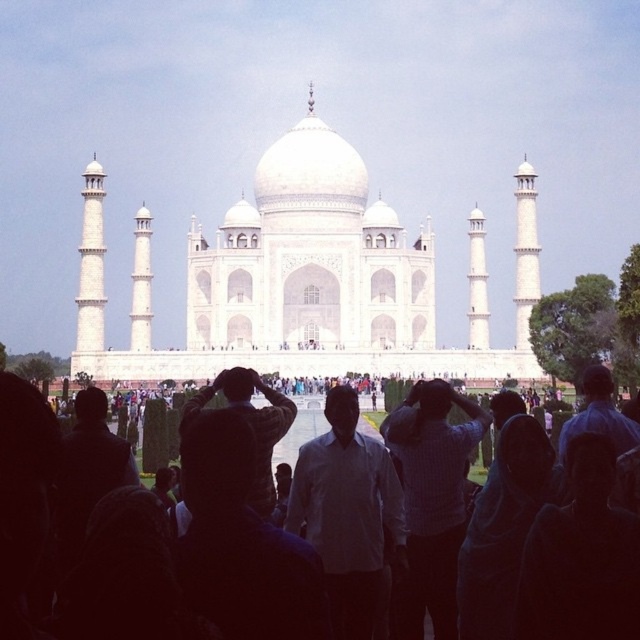
Question: Is white marble taj mahal at center closer to the viewer compared to matte white people at center?

Choices:
 (A) yes
 (B) no

Answer: (B)

Question: Which of these objects is positioned farthest from the matte white people at center?

Choices:
 (A) white marble taj mahal at center
 (B) white textured shirt at center

Answer: (A)

Question: Which point appears closest to the camera in this image?

Choices:
 (A) (436, 573)
 (B) (252, 316)

Answer: (A)

Question: Is white marble taj mahal at center further to the viewer compared to matte white people at center?

Choices:
 (A) yes
 (B) no

Answer: (A)

Question: Which point appears farthest from the camera in this image?

Choices:
 (A) (445, 419)
 (B) (200, 374)

Answer: (B)

Question: Can you confirm if matte white people at center is positioned to the right of white textured shirt at center?

Choices:
 (A) no
 (B) yes

Answer: (A)